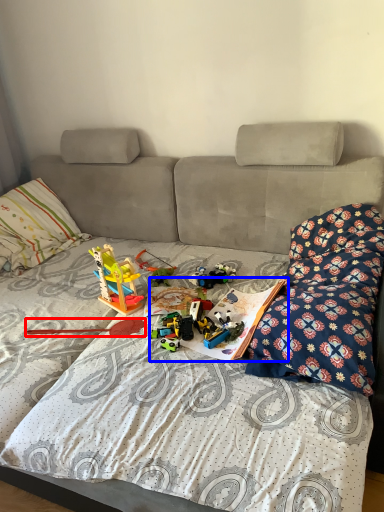
Question: Which object appears farthest to the camera in this image, twin (highlighted by a red box) or book (highlighted by a blue box)?

Choices:
 (A) twin
 (B) book

Answer: (A)